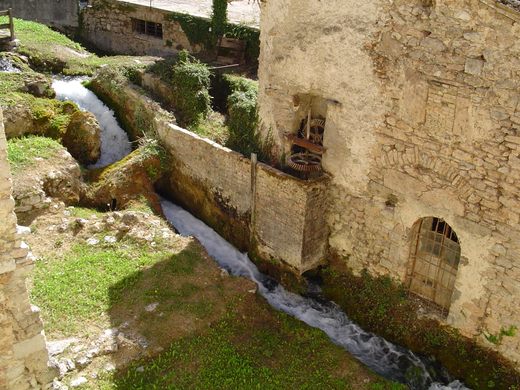
Locate an element on the screen. wall is located at coordinates (238, 177).